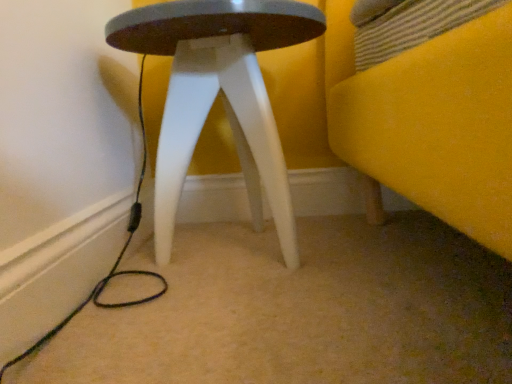
In order to click on free location to the right of black cable at lower left in this screenshot , I will do `click(279, 268)`.